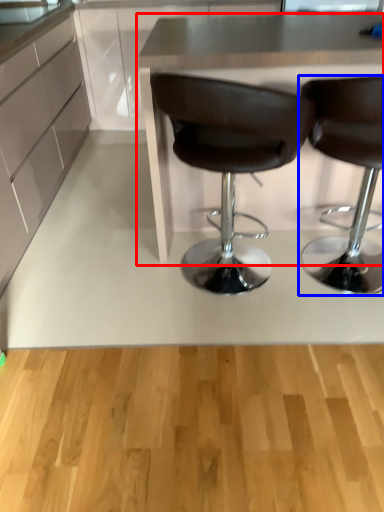
Question: Which point is closer to the camera, table (highlighted by a red box) or chair (highlighted by a blue box)?

Choices:
 (A) table
 (B) chair

Answer: (B)